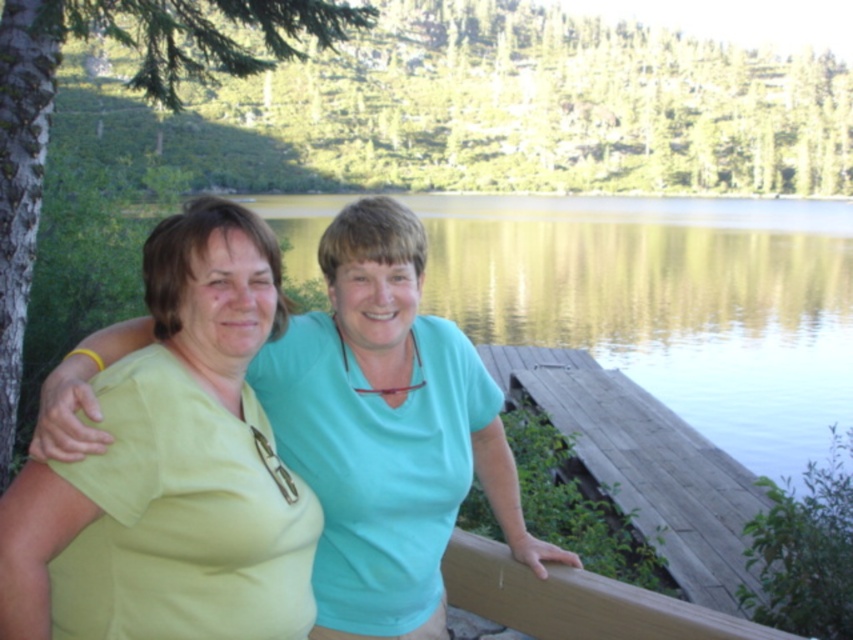
Question: Is matte green shirt at center above wooden dock at lower right?

Choices:
 (A) yes
 (B) no

Answer: (A)

Question: Which point is farther to the camera?

Choices:
 (A) brown wood rail at lower center
 (B) matte green shirt at center
 (C) wooden dock at lower right

Answer: (B)

Question: Is matte green shirt at center below brown wood rail at lower center?

Choices:
 (A) yes
 (B) no

Answer: (B)

Question: Among these points, which one is nearest to the camera?

Choices:
 (A) (146, 486)
 (B) (442, 561)
 (C) (610, 589)

Answer: (A)

Question: Which object is closer to the camera taking this photo?

Choices:
 (A) matte green shirt at center
 (B) wooden dock at lower right
 (C) brown wood rail at lower center

Answer: (C)

Question: Does matte green shirt at center have a greater width compared to wooden dock at lower right?

Choices:
 (A) no
 (B) yes

Answer: (A)